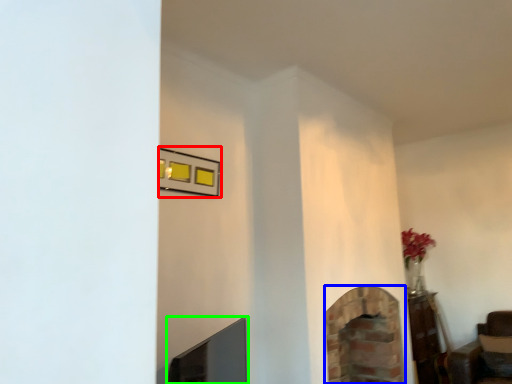
Question: Which object is the closest to the picture frame (highlighted by a red box)? Choose among these: fireplace (highlighted by a blue box) or fireplace (highlighted by a green box).

Choices:
 (A) fireplace
 (B) fireplace

Answer: (B)